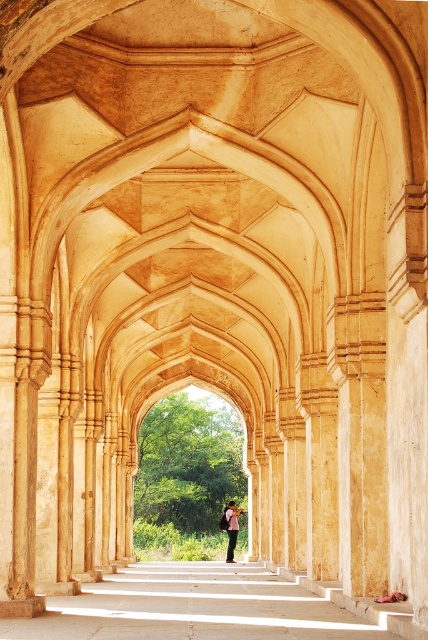
Question: Which point appears farthest from the camera in this image?

Choices:
 (A) (258, 627)
 (B) (228, 520)

Answer: (B)

Question: Can you confirm if smooth stone path at center is thinner than light pink fabric at center?

Choices:
 (A) yes
 (B) no

Answer: (B)

Question: Where is smooth stone path at center located in relation to light pink fabric at center in the image?

Choices:
 (A) left
 (B) right

Answer: (A)

Question: Is smooth stone path at center smaller than light pink fabric at center?

Choices:
 (A) no
 (B) yes

Answer: (A)